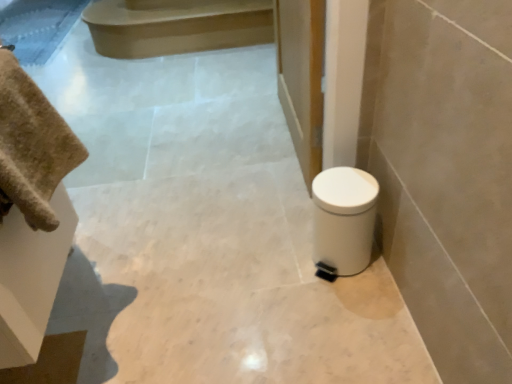
Where is `vacant point above white plastic toilet at lower right (from a real-world perspective)`? This screenshot has width=512, height=384. vacant point above white plastic toilet at lower right (from a real-world perspective) is located at coordinates coord(342,188).